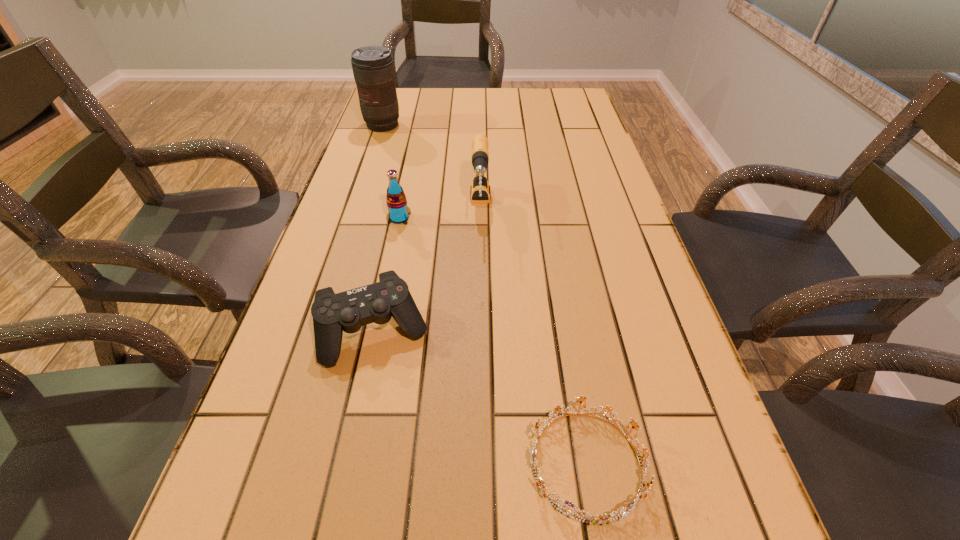
The width and height of the screenshot is (960, 540). Find the location of `vacant space located 0.390m on the front of the soda`. vacant space located 0.390m on the front of the soda is located at coordinates (371, 352).

Identify the location of vacant area situated 0.350m on the back of the fourth tallest object. This screenshot has width=960, height=540. (403, 202).

Locate an element on the screen. The image size is (960, 540). telephoto lens positioned at the left edge is located at coordinates (373, 68).

Where is `soda at the left edge`? The width and height of the screenshot is (960, 540). soda at the left edge is located at coordinates (396, 201).

The image size is (960, 540). Find the location of `control that is at the left edge`. control that is at the left edge is located at coordinates (348, 311).

Locate an element on the screen. The height and width of the screenshot is (540, 960). object present at the right edge is located at coordinates (624, 511).

The width and height of the screenshot is (960, 540). In order to click on vacant space at the far edge of the desktop in this screenshot , I will do `click(533, 97)`.

The image size is (960, 540). I want to click on free point at the left edge, so click(314, 332).

This screenshot has height=540, width=960. Find the location of `vacant region at the right edge of the desktop`. vacant region at the right edge of the desktop is located at coordinates (639, 269).

In order to click on free point at the far left corner in this screenshot , I will do tap(403, 96).